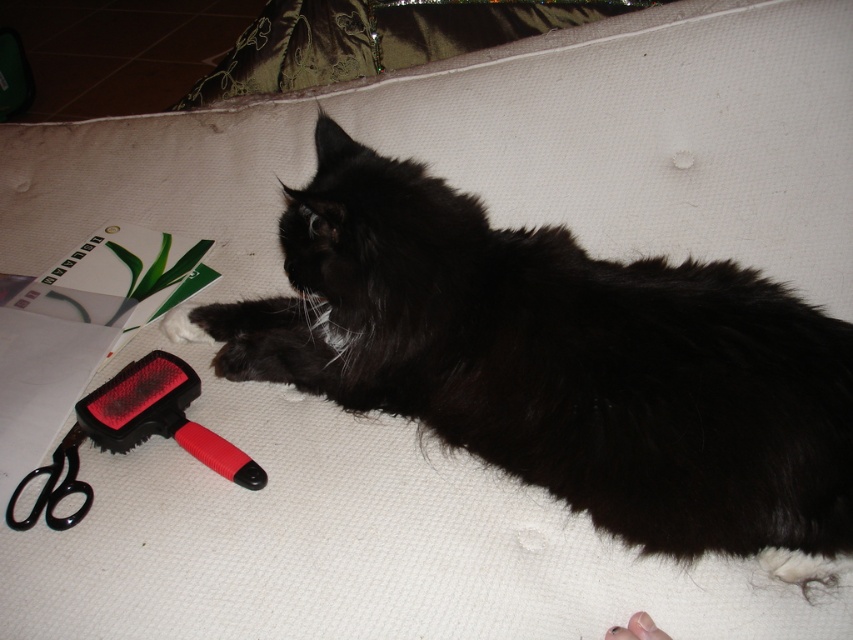
Question: Can you confirm if black fluffy cat at center is positioned to the right of red plastic brush at lower left?

Choices:
 (A) yes
 (B) no

Answer: (A)

Question: Can you confirm if black fluffy cat at center is positioned to the left of red plastic brush at lower left?

Choices:
 (A) no
 (B) yes

Answer: (A)

Question: Can you confirm if black fluffy cat at center is thinner than red plastic brush at lower left?

Choices:
 (A) no
 (B) yes

Answer: (A)